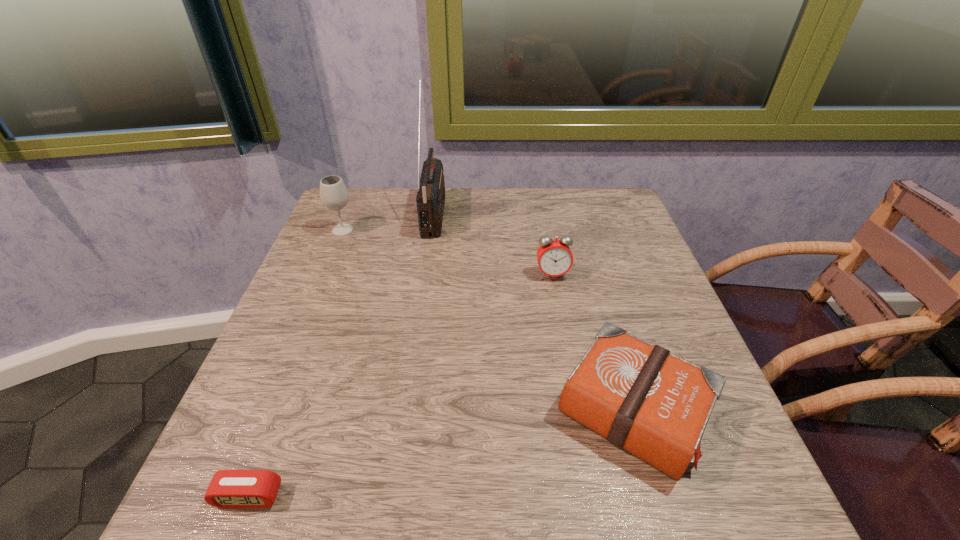
The image size is (960, 540). What are the coordinates of `object at the near left corner` in the screenshot? It's located at (228, 488).

Find the location of `object situated at the near right corner`. object situated at the near right corner is located at coordinates (640, 397).

The width and height of the screenshot is (960, 540). In the image, there is a desktop. Identify the location of vacant space at the far edge. (558, 201).

Locate an element on the screen. vacant point at the left edge is located at coordinates (315, 243).

In the image, there is a desktop. Where is `vacant region at the right edge`? This screenshot has width=960, height=540. vacant region at the right edge is located at coordinates (674, 320).

The image size is (960, 540). I want to click on free spot at the near left corner of the desktop, so click(185, 519).

I want to click on vacant area at the far right corner of the desktop, so click(x=596, y=197).

In the image, there is a desktop. In order to click on vacant area at the near right corner in this screenshot , I will do `click(688, 488)`.

At what (x,y) coordinates should I click in order to perform the action: click on free spot between the third object from left to right and the second tallest object. Please return your answer as a coordinate pair (x, y). The image size is (960, 540). Looking at the image, I should click on (389, 221).

Locate an element on the screen. This screenshot has height=540, width=960. free space between the radio receiver and the third tallest object is located at coordinates (493, 244).